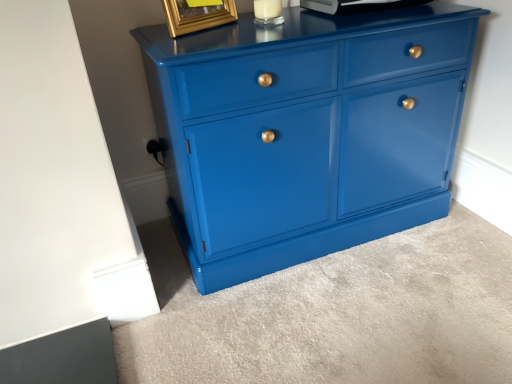
The height and width of the screenshot is (384, 512). In order to click on free space in front of glossy blue cabinet at center in this screenshot , I will do `click(336, 311)`.